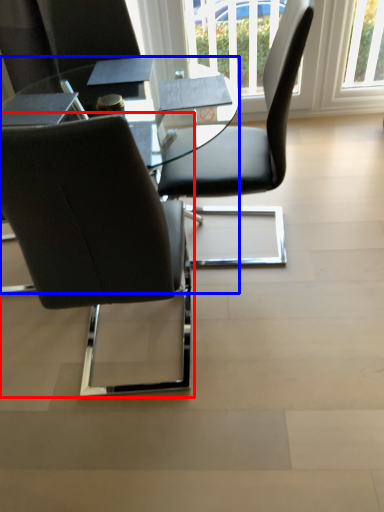
Question: Which of the following is the closest to the observer, chair (highlighted by a red box) or table (highlighted by a blue box)?

Choices:
 (A) chair
 (B) table

Answer: (A)